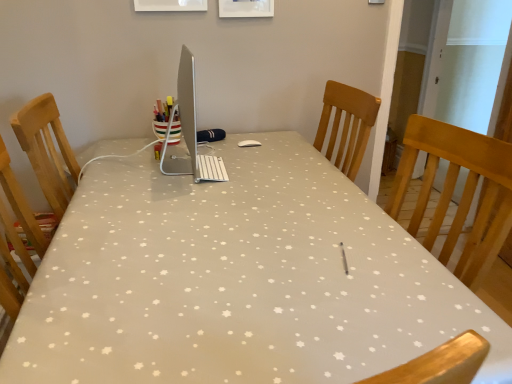
Find the location of a particular element. Image resolution: width=512 pixels, height=384 pixels. vacant space to the right of sleek silver desktop at center is located at coordinates tap(272, 168).